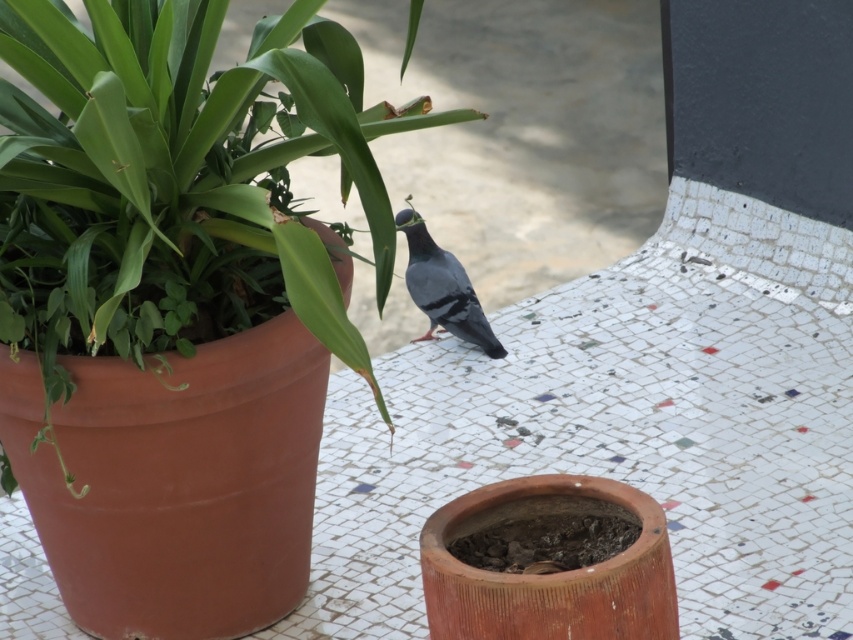
You are standing 10 feet away from a green matte pot at center. Can you reach it without moving closer?

The green matte pot at center is 7.87 feet away from the viewer, so if you are standing 10 feet away, you cannot reach it without moving closer.

You are standing in the outdoor setting and want to place a small decorative statue exactly at point (x=177, y=182). According to the scene description, what object is currently located at that coordinate?

The green matte pot at center is located at point (x=177, y=182).